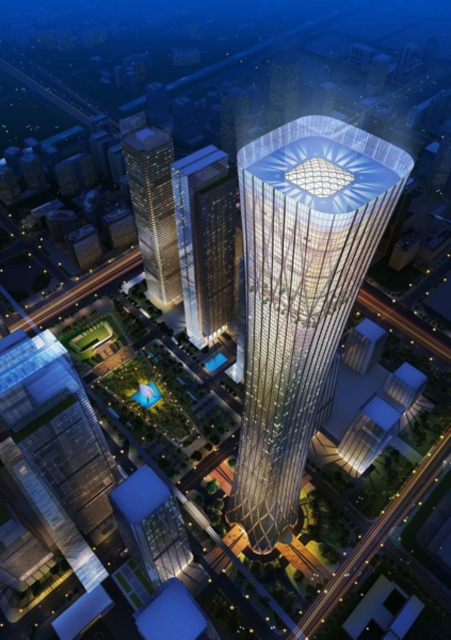
Question: Which of these objects is positioned closest to the gold glass tower at center?

Choices:
 (A) transparent glass skyscraper at center
 (B) gold glass skyscraper at left

Answer: (A)

Question: Does transparent glass skyscraper at center have a greater width compared to gold glass skyscraper at left?

Choices:
 (A) no
 (B) yes

Answer: (B)

Question: Can you confirm if gold glass tower at center is positioned to the right of transparent glass skyscraper at center?

Choices:
 (A) no
 (B) yes

Answer: (B)

Question: Which point is farther to the camera?

Choices:
 (A) (222, 262)
 (B) (142, 180)

Answer: (A)

Question: Is the position of gold glass tower at center more distant than that of gold glass skyscraper at left?

Choices:
 (A) yes
 (B) no

Answer: (B)

Question: Which object is positioned farthest from the gold glass skyscraper at left?

Choices:
 (A) gold glass tower at center
 (B) transparent glass skyscraper at center

Answer: (A)